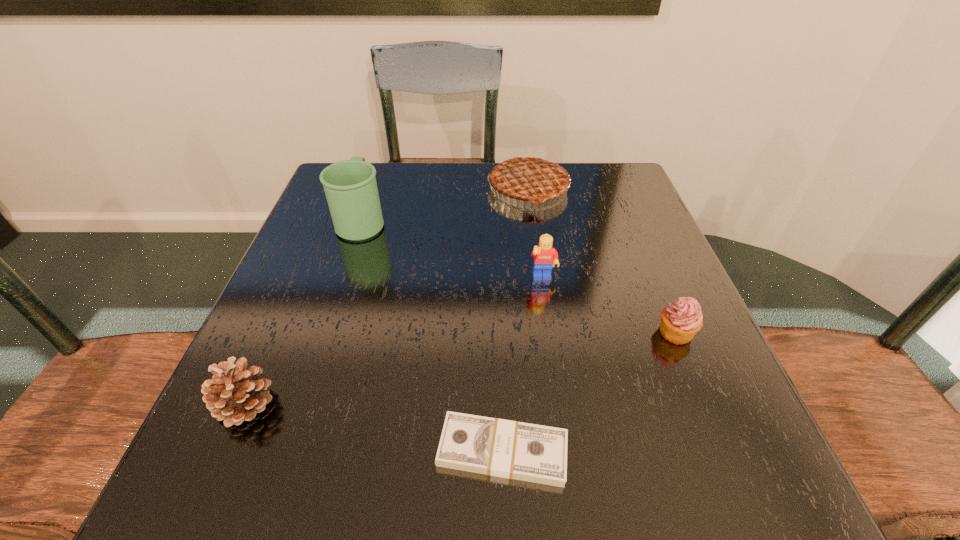
Locate an element on the screen. The image size is (960, 540). vacant region located on the side of the mug with the handle is located at coordinates (379, 167).

The image size is (960, 540). I want to click on vacant region located 0.060m on the face of the third farthest object, so click(547, 309).

What are the coordinates of `vacant position located 0.120m on the back of the pinecone` in the screenshot? It's located at (281, 322).

Locate an element on the screen. free point located on the left of the second shortest object is located at coordinates (532, 332).

The width and height of the screenshot is (960, 540). Find the location of `vacant area situated 0.100m on the left of the dollar`. vacant area situated 0.100m on the left of the dollar is located at coordinates (366, 451).

Image resolution: width=960 pixels, height=540 pixels. Find the location of `pie at the far edge`. pie at the far edge is located at coordinates (531, 178).

This screenshot has height=540, width=960. Identify the location of mug that is at the far edge. [350, 186].

Locate an element on the screen. The image size is (960, 540). object present at the near edge is located at coordinates (503, 448).

The width and height of the screenshot is (960, 540). Identify the location of mug located in the left edge section of the desktop. (350, 186).

Identify the location of pinecone present at the left edge. The height and width of the screenshot is (540, 960). (235, 394).